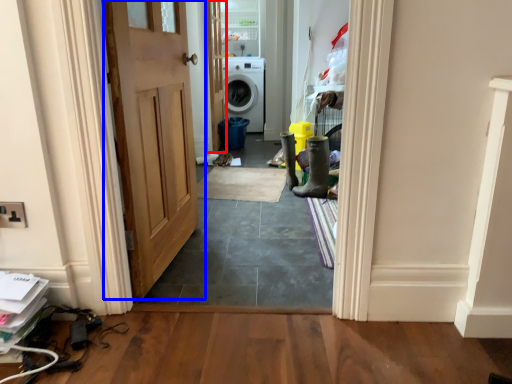
Question: Among these objects, which one is farthest to the camera, door (highlighted by a red box) or door (highlighted by a blue box)?

Choices:
 (A) door
 (B) door

Answer: (A)